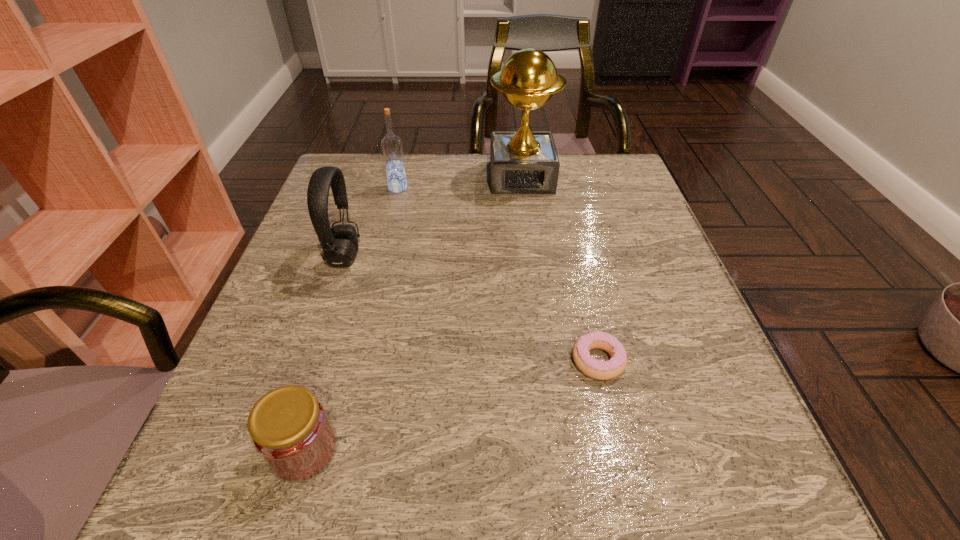
Where is `the tallest object`? The height and width of the screenshot is (540, 960). the tallest object is located at coordinates (524, 162).

You are a GUI agent. You are given a task and a screenshot of the screen. Output one action in this format:
    pyautogui.click(x=<x>, y=<y>)
    Task: Click on the vodka
    Image resolution: width=960 pixels, height=540 pixels.
    Given the screenshot: What is the action you would take?
    tap(391, 145)

Identify the location of the third nearest object. Image resolution: width=960 pixels, height=540 pixels. (339, 243).

Identify the location of jam. This screenshot has height=540, width=960. (289, 427).

I want to click on the fourth tallest object, so click(289, 427).

Image resolution: width=960 pixels, height=540 pixels. I want to click on the shortest object, so click(601, 370).

Locate an element on the screen. The height and width of the screenshot is (540, 960). doughnut is located at coordinates (601, 370).

Where is `free space located 0.090m on the front-facing side of the award`? This screenshot has width=960, height=540. free space located 0.090m on the front-facing side of the award is located at coordinates (526, 217).

The height and width of the screenshot is (540, 960). In order to click on vacant space located on the back of the vodka in this screenshot , I will do `click(406, 156)`.

This screenshot has height=540, width=960. What are the coordinates of `free space located 0.350m on the front-facing side of the third nearest object` in the screenshot? It's located at (528, 256).